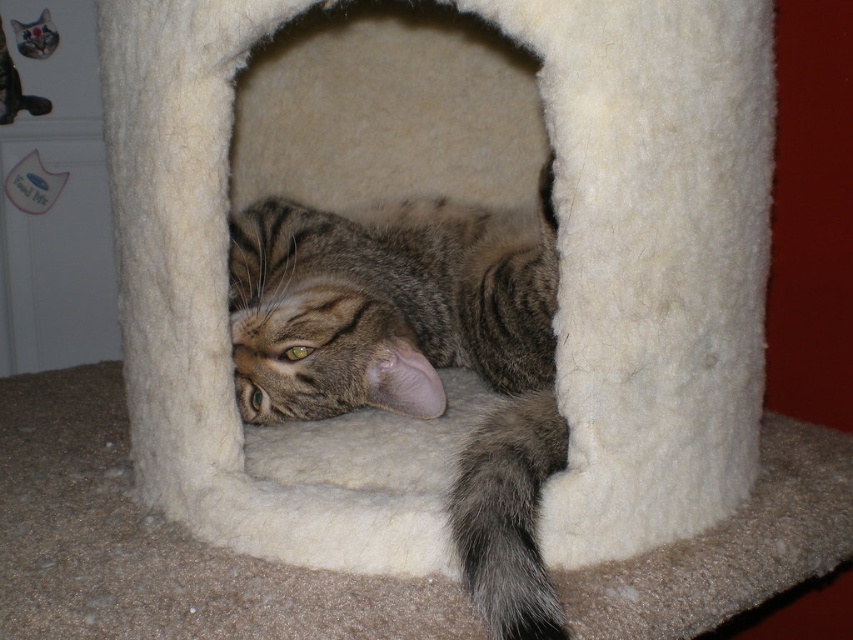
Question: Can you confirm if white felt cat bed at center is bigger than tabby fur cat at center?

Choices:
 (A) yes
 (B) no

Answer: (A)

Question: Which of the following is the closest to the observer?

Choices:
 (A) (x=128, y=108)
 (B) (x=521, y=236)

Answer: (A)

Question: In this image, where is white felt cat bed at center located relative to tabby fur cat at center?

Choices:
 (A) right
 (B) left

Answer: (A)

Question: Which point is closer to the camera?

Choices:
 (A) (184, 380)
 (B) (544, 589)

Answer: (B)

Question: Is white felt cat bed at center to the left of tabby fur cat at center from the viewer's perspective?

Choices:
 (A) no
 (B) yes

Answer: (A)